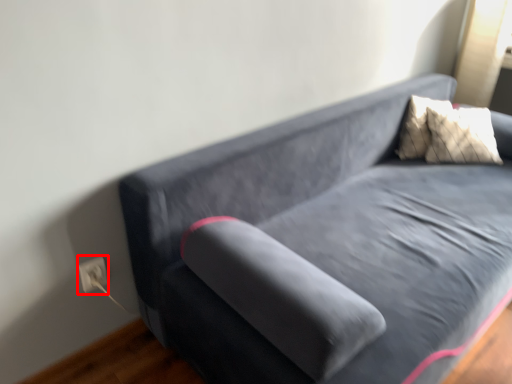
Question: Considering the relative positions of electric outlet (annotated by the red box) and hardwood in the image provided, where is electric outlet (annotated by the red box) located with respect to the staircase?

Choices:
 (A) left
 (B) right

Answer: (B)